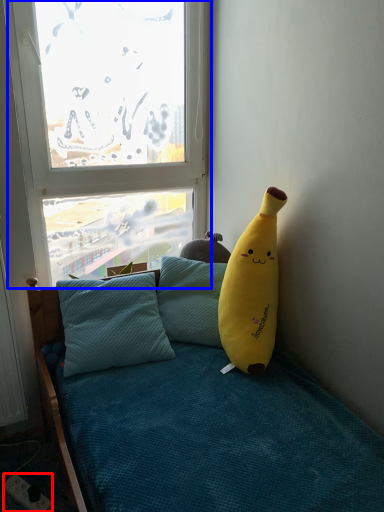
Question: Among these objects, which one is farthest to the camera, power outlet (highlighted by a red box) or window (highlighted by a blue box)?

Choices:
 (A) power outlet
 (B) window

Answer: (B)